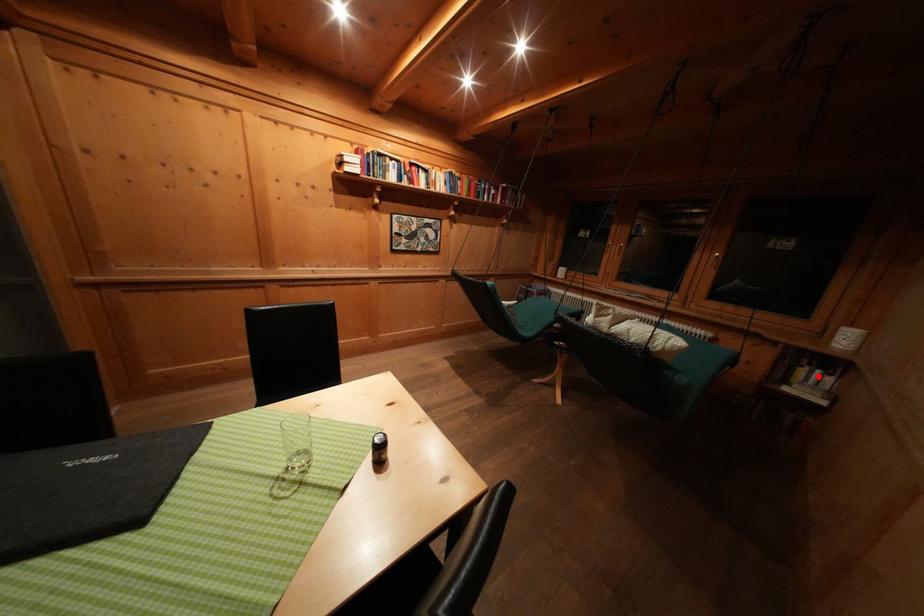
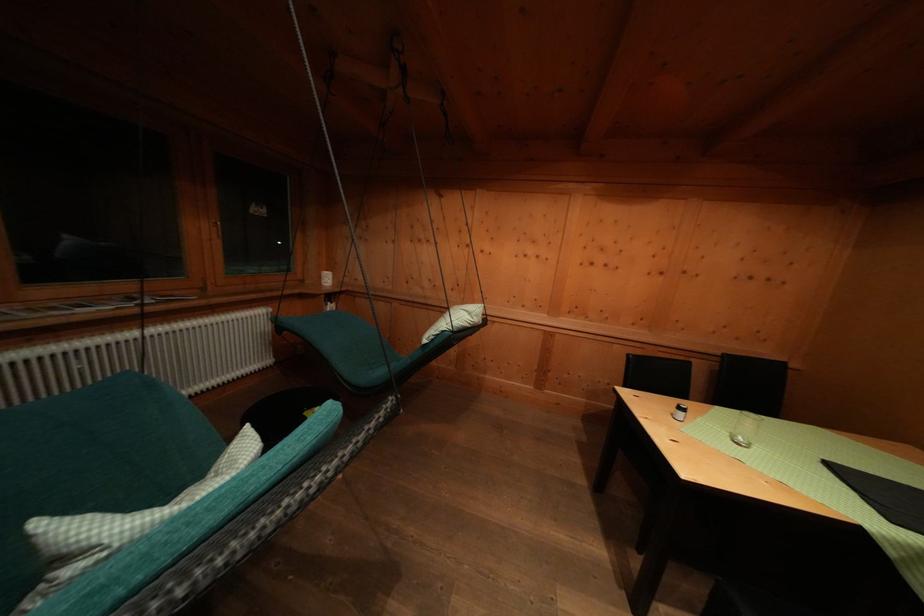
In the second image, find the point that corresponds to the highlighted location in the first image.

(333, 310)